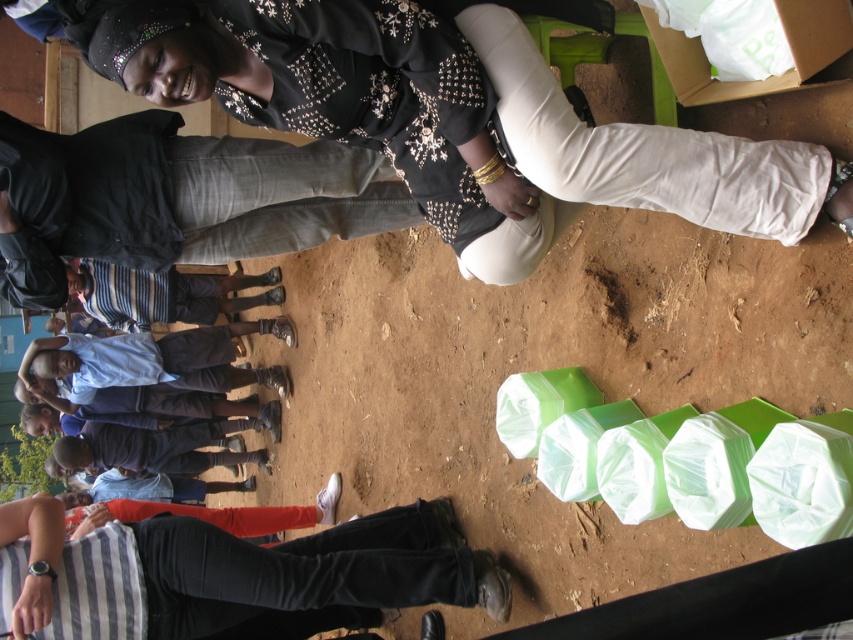
Question: Can you confirm if matte black blouse at upper center is positioned to the right of black jeans at lower center?

Choices:
 (A) yes
 (B) no

Answer: (A)

Question: Estimate the real-world distances between objects in this image. Which object is farther from the matte black blouse at upper center?

Choices:
 (A) black jeans at lower center
 (B) blue shirt at lower left

Answer: (B)

Question: Can you confirm if matte black blouse at upper center is smaller than blue shirt at lower left?

Choices:
 (A) yes
 (B) no

Answer: (A)

Question: Which point is closer to the camera taking this photo?

Choices:
 (A) (193, 388)
 (B) (706, 209)

Answer: (B)

Question: Does matte black blouse at upper center appear on the left side of black jeans at lower center?

Choices:
 (A) yes
 (B) no

Answer: (B)

Question: Which of the following is the closest to the observer?

Choices:
 (A) black jeans at lower center
 (B) matte black blouse at upper center
 (C) blue shirt at lower left

Answer: (B)